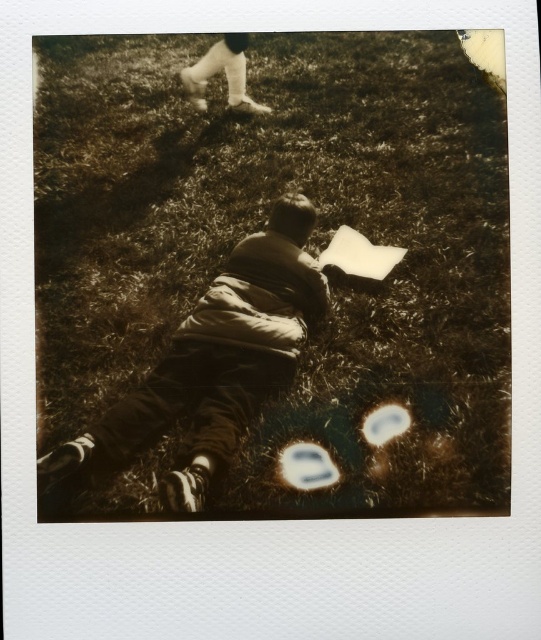
Question: Does brown cotton shirt at center appear on the right side of white fabric pants at upper center?

Choices:
 (A) yes
 (B) no

Answer: (A)

Question: Can you confirm if brown grass at center is positioned below white fabric pants at upper center?

Choices:
 (A) yes
 (B) no

Answer: (A)

Question: Can you confirm if brown cotton shirt at center is positioned to the right of white fabric pants at upper center?

Choices:
 (A) yes
 (B) no

Answer: (A)

Question: Estimate the real-world distances between objects in this image. Which object is closer to the brown grass at center?

Choices:
 (A) white fabric pants at upper center
 (B) brown cotton shirt at center

Answer: (B)

Question: Among these objects, which one is farthest from the camera?

Choices:
 (A) white fabric pants at upper center
 (B) brown grass at center
 (C) brown cotton shirt at center

Answer: (A)

Question: Which point appears farthest from the camera in this image?

Choices:
 (A) (335, 218)
 (B) (227, 44)
 (C) (190, 412)

Answer: (B)